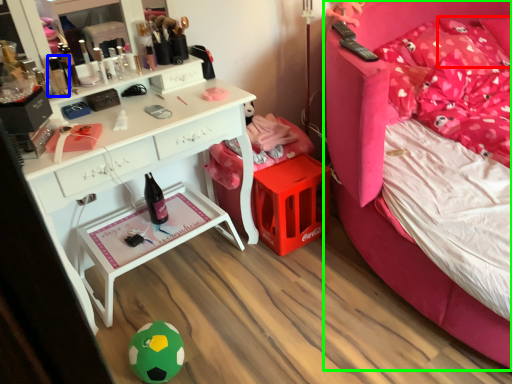
Question: Considering the real-world distances, which object is farthest from pillow (highlighted by a red box)? toiletry (highlighted by a blue box) or bed (highlighted by a green box)?

Choices:
 (A) toiletry
 (B) bed

Answer: (A)